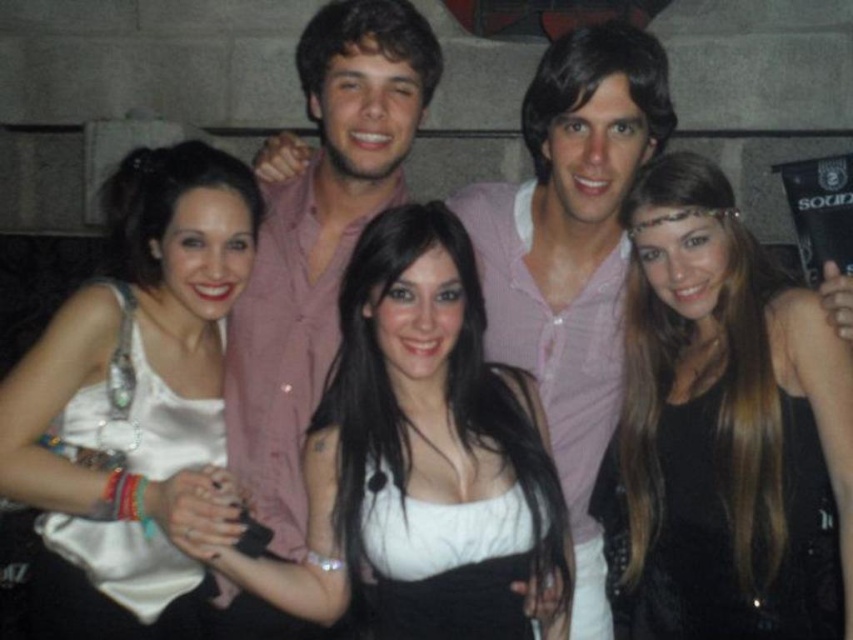
You are a photographer trying to adjust the lighting for a group photo. You notice two clothing items at the center of the image, the black leather dress at center and the white satin tank top at center. Which clothing item is positioned higher in the image?

The black leather dress at center is much taller as white satin tank top at center, so the black leather dress at center is positioned higher in the image.

Based on the scene description, where is the white satin dress at center located in terms of its 2D coordinates?

The white satin dress at center is located at the 2D coordinates point (421, 458).